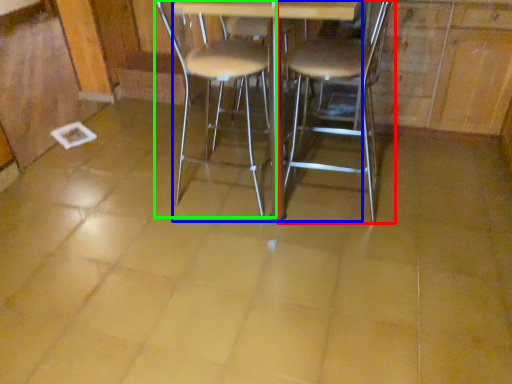
Question: Which object is the farthest from chair (highlighted by a red box)? Choose among these: round table (highlighted by a blue box) or chair (highlighted by a green box).

Choices:
 (A) round table
 (B) chair

Answer: (A)